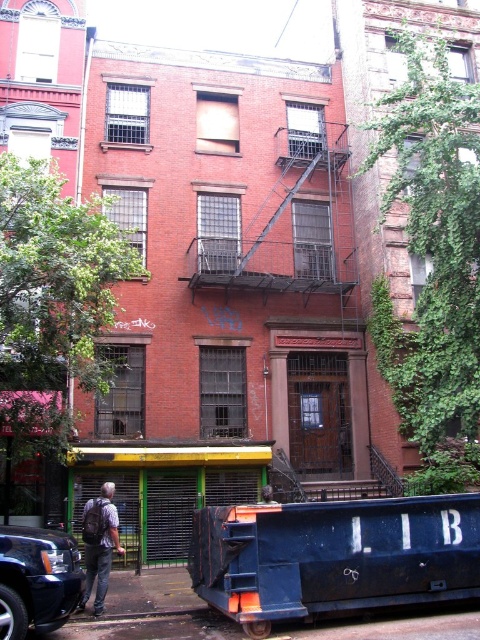
Locate an element on the screen. shiny black suv at lower left is located at coordinates (36, 579).

Can you confirm if shiny black suv at lower left is smaller than denim jacket at lower left?

Actually, shiny black suv at lower left might be larger than denim jacket at lower left.

Is point (8, 637) in front of point (85, 515)?

That is True.

Identify the location of shiny black suv at lower left. Image resolution: width=480 pixels, height=640 pixels. (36, 579).